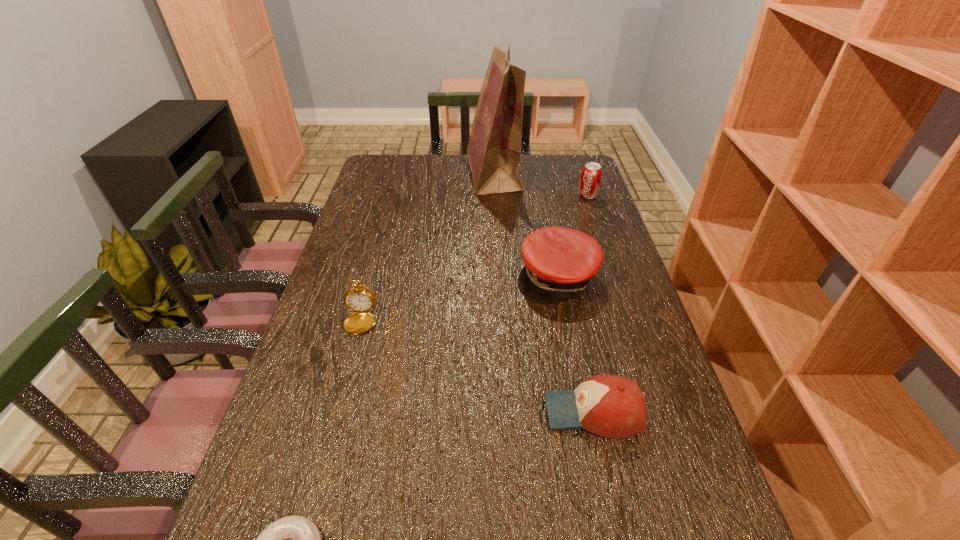
Locate an element on the screen. The width and height of the screenshot is (960, 540). free spot at the far edge of the desktop is located at coordinates (530, 174).

The height and width of the screenshot is (540, 960). I want to click on vacant space at the left edge, so click(x=352, y=421).

You are a GUI agent. You are given a task and a screenshot of the screen. Output one action in this format:
    pyautogui.click(x=<x>, y=<y>)
    Task: Click on the free space at the right edge
    
    Given the screenshot: What is the action you would take?
    pyautogui.click(x=601, y=299)

This screenshot has width=960, height=540. I want to click on blank space at the far left corner of the desktop, so click(x=410, y=177).

Identify the location of free space that is in between the tallest object and the pocket watch. (432, 247).

You are a GUI agent. You are given a task and a screenshot of the screen. Output one action in this format:
    pyautogui.click(x=<x>, y=<y>)
    Task: Click on the empty space between the baseball cap and the soda
    This screenshot has height=540, width=960.
    Given the screenshot: What is the action you would take?
    pyautogui.click(x=590, y=304)

Where is `vacant space that's between the third farthest object and the baseball cap`? vacant space that's between the third farthest object and the baseball cap is located at coordinates (575, 345).

In order to click on empty space between the fourth nearest object and the pocket watch in this screenshot , I will do pos(464,299).

This screenshot has width=960, height=540. What are the coordinates of `free space that is in between the grocery bag and the rightmost object` in the screenshot? It's located at (540, 185).

Select which object is the fourth closest to the third nearest object. Please provide its 2D coordinates. Your answer should be formatted as a tuple, i.e. [(x, y)], where the tuple contains the x and y coordinates of a point satisfying the conditions above.

[(494, 148)]